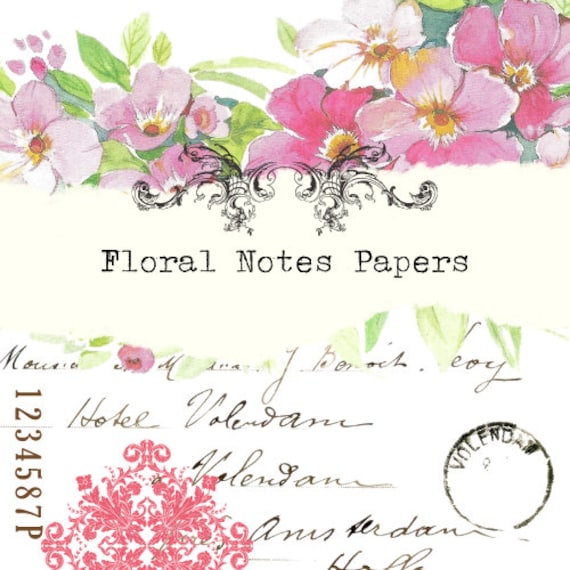
The image size is (570, 570). What are the coordinates of `notepad cover` in the screenshot? It's located at (228, 32).